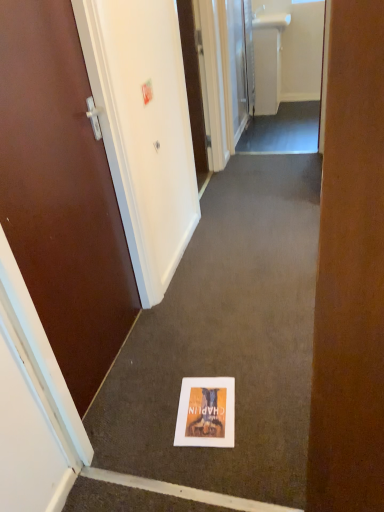
What do you see at coordinates (206, 412) in the screenshot? I see `matte paper flyer at center` at bounding box center [206, 412].

You are a GUI agent. You are given a task and a screenshot of the screen. Output one action in this format:
    pyautogui.click(x=<x>, y=<y>)
    Task: Click on the white glossy door at upper center, the 1th door from the top
    
    Given the screenshot: What is the action you would take?
    pyautogui.click(x=240, y=64)

This screenshot has width=384, height=512. Describe the element at coordinates (240, 64) in the screenshot. I see `white glossy door at upper center, the 1th door positioned from the right` at that location.

What is the approximate width of brown wooden door at left, placed as the second door when sorted from top to bottom?

brown wooden door at left, placed as the second door when sorted from top to bottom, is 3.16 inches wide.

Measure the distance between point (x=249, y=137) and camera.

4.05 meters.

Where is `white plastic sink at upper center`? This screenshot has height=512, width=384. white plastic sink at upper center is located at coordinates (268, 60).

Can you tell me how much matte paper flyer at center and brown wooden door at left, the 1th door in the bottom-to-top sequence, differ in facing direction?

There is a 99.4-degree angle between the facing directions of matte paper flyer at center and brown wooden door at left, the 1th door in the bottom-to-top sequence.

Considering the positions of objects matte paper flyer at center and brown wooden door at left, placed as the second door when sorted from top to bottom, in the image provided, who is behind, matte paper flyer at center or brown wooden door at left, placed as the second door when sorted from top to bottom,?

Positioned behind is matte paper flyer at center.

Considering the points (210, 414) and (37, 195), which point is behind, point (210, 414) or point (37, 195)?

The point (210, 414) is more distant.

From the image's perspective, is white glossy sink at upper center under brown wooden door at left, positioned as the 2th door in back-to-front order?

No.

Looking at this image, considering the positions of objects white glossy sink at upper center and brown wooden door at left, the second door viewed from the right, in the image provided, who is more to the right, white glossy sink at upper center or brown wooden door at left, the second door viewed from the right,?

Positioned to the right is white glossy sink at upper center.

Would you say white glossy sink at upper center is outside brown wooden door at left, placed as the 1th door when sorted from left to right?

Indeed, white glossy sink at upper center is completely outside brown wooden door at left, placed as the 1th door when sorted from left to right.

Considering the positions of points (317, 97) and (39, 293), is point (317, 97) farther from camera compared to point (39, 293)?

Yes.

Is matte paper flyer at center situated inside white glossy sink at upper center or outside?

matte paper flyer at center cannot be found inside white glossy sink at upper center.

Based on the photo, in the image, is matte paper flyer at center positioned in front of or behind white glossy sink at upper center?

Clearly, matte paper flyer at center is in front of white glossy sink at upper center.

Is matte paper flyer at center wider or thinner than white glossy sink at upper center?

Considering their sizes, matte paper flyer at center looks broader than white glossy sink at upper center.

Based on the photo, from a real-world perspective, who is located lower, matte paper flyer at center or white glossy sink at upper center?

matte paper flyer at center is physically lower.

I want to click on passage lying below the white plastic sink at upper center (from the image's perspective), so click(x=287, y=78).

Is white plastic sink at upper center at the back of white glossy sink at upper center?

Yes, white glossy sink at upper center's orientation is away from white plastic sink at upper center.

Based on the photo, is white glossy sink at upper center in front of or behind white plastic sink at upper center in the image?

In the image, white glossy sink at upper center appears in front of white plastic sink at upper center.

Which of these two, matte paper flyer at center or white plastic sink at upper center, stands shorter?

Standing shorter between the two is matte paper flyer at center.

Who is smaller, matte paper flyer at center or white plastic sink at upper center?

matte paper flyer at center.

Is matte paper flyer at center at the left side of white plastic sink at upper center?

Indeed, matte paper flyer at center is positioned on the left side of white plastic sink at upper center.

From the image's perspective, which is above, matte paper flyer at center or white plastic sink at upper center?

white plastic sink at upper center appears higher in the image.

Is brown wooden door at left, positioned as the 2th door in back-to-front order, positioned in front of white glossy sink at upper center?

Yes, it is.

Would you say brown wooden door at left, positioned as the 2th door in back-to-front order, is outside white glossy sink at upper center?

brown wooden door at left, positioned as the 2th door in back-to-front order, is positioned outside white glossy sink at upper center.

From a real-world perspective, is brown wooden door at left, the 1th door in the bottom-to-top sequence, positioned under white glossy sink at upper center based on gravity?

No, from a real-world perspective, brown wooden door at left, the 1th door in the bottom-to-top sequence, is not under white glossy sink at upper center.

From the image's perspective, is brown wooden door at left, positioned as the first door in front-to-back order, below white glossy sink at upper center?

Yes.

Is white glossy door at upper center, the second door from the bottom, located outside white glossy sink at upper center?

That's correct, white glossy door at upper center, the second door from the bottom, is outside of white glossy sink at upper center.

Which object is further away from the camera, white glossy door at upper center, the 1th door positioned from the right, or white glossy sink at upper center?

Positioned behind is white glossy door at upper center, the 1th door positioned from the right.

What's the angular difference between white glossy door at upper center, which ranks as the first door in back-to-front order, and white glossy sink at upper center's facing directions?

87.8 degrees.

Can you confirm if white glossy door at upper center, which ranks as the first door in back-to-front order, is shorter than white glossy sink at upper center?

Correct, white glossy door at upper center, which ranks as the first door in back-to-front order, is not as tall as white glossy sink at upper center.

This screenshot has height=512, width=384. I want to click on door in front of the matte paper flyer at center, so click(x=61, y=195).

The height and width of the screenshot is (512, 384). In order to click on passage above the brown wooden door at left, the 1th door in the bottom-to-top sequence (from the image's perspective) in this screenshot , I will do `click(287, 78)`.

From the image, which object appears to be nearer to white glossy sink at upper center, brown wooden door at left, the 1th door in the bottom-to-top sequence, or white glossy door at upper center, the 1th door from the top?

The object closer to white glossy sink at upper center is white glossy door at upper center, the 1th door from the top.

Which object lies further to the anchor point white glossy sink at upper center, matte paper flyer at center or white glossy door at upper center, the second door from the bottom?

matte paper flyer at center is further to white glossy sink at upper center.

Looking at the image, which one is located closer to brown wooden door at left, placed as the 1th door when sorted from left to right, white glossy sink at upper center or white glossy door at upper center, the second door from the bottom?

The object closer to brown wooden door at left, placed as the 1th door when sorted from left to right, is white glossy door at upper center, the second door from the bottom.

Estimate the real-world distances between objects in this image. Which object is closer to white plastic sink at upper center, matte paper flyer at center or white glossy door at upper center, the second door from the bottom?

Among the two, white glossy door at upper center, the second door from the bottom, is located nearer to white plastic sink at upper center.

Based on their spatial positions, is white plastic sink at upper center or matte paper flyer at center further from white glossy door at upper center, the 1th door from the top?

matte paper flyer at center lies further to white glossy door at upper center, the 1th door from the top, than the other object.

From the image, which object appears to be farther from white glossy door at upper center, the 1th door from the top, white glossy sink at upper center or white plastic sink at upper center?

white glossy sink at upper center lies further to white glossy door at upper center, the 1th door from the top, than the other object.

Looking at the image, which one is located further to white glossy sink at upper center, white glossy door at upper center, the 1th door from the top, or brown wooden door at left, the second door viewed from the right?

brown wooden door at left, the second door viewed from the right.

Based on their spatial positions, is white glossy door at upper center, the 1th door positioned from the right, or white glossy sink at upper center further from matte paper flyer at center?

white glossy sink at upper center is further to matte paper flyer at center.

The width and height of the screenshot is (384, 512). What are the coordinates of `passage between white plastic sink at upper center and matte paper flyer at center in the up-down direction` in the screenshot? It's located at (287, 78).

Where is `passage between white glossy door at upper center, which is the second door in left-to-right order, and matte paper flyer at center from top to bottom`? The height and width of the screenshot is (512, 384). passage between white glossy door at upper center, which is the second door in left-to-right order, and matte paper flyer at center from top to bottom is located at coordinates (287, 78).

Identify the location of flyer located between brown wooden door at left, positioned as the first door in front-to-back order, and white glossy door at upper center, the second door from the bottom, in the depth direction. (206, 412).

You are a GUI agent. You are given a task and a screenshot of the screen. Output one action in this format:
    pyautogui.click(x=<x>, y=<y>)
    Task: Click on the door between brown wooden door at left, positioned as the first door in front-to-back order, and white plastic sink at upper center in the front-back direction
    
    Given the screenshot: What is the action you would take?
    pyautogui.click(x=240, y=64)